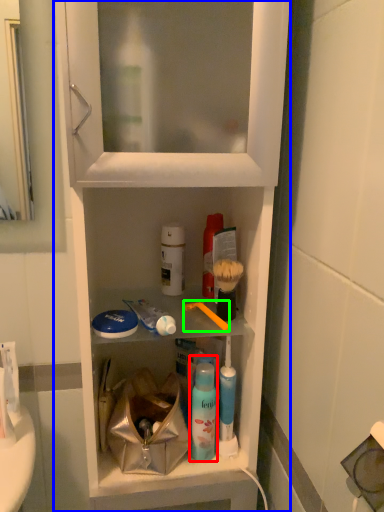
Question: Which object is the farthest from mouthwash (highlighted by a red box)? Choose among these: cabinetry (highlighted by a blue box) or toothbrush (highlighted by a green box).

Choices:
 (A) cabinetry
 (B) toothbrush

Answer: (A)